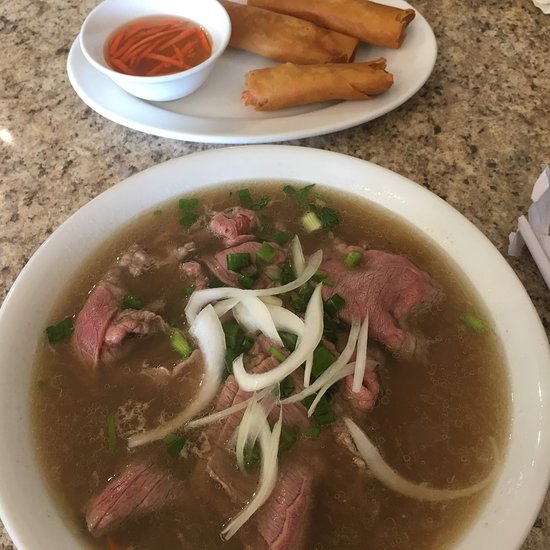
Image resolution: width=550 pixels, height=550 pixels. I want to click on white circular bowl, so click(x=526, y=473).